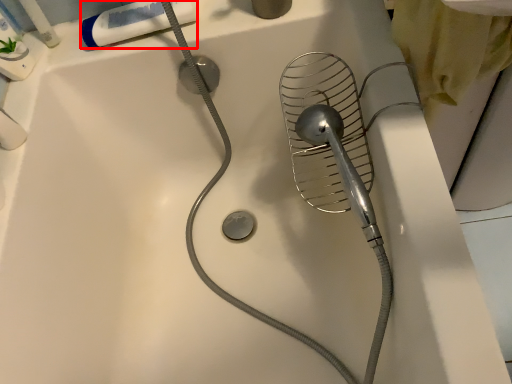
Question: From the image's perspective, where is toothpaste (annotated by the red box) located relative to toiletry?

Choices:
 (A) above
 (B) below

Answer: (B)